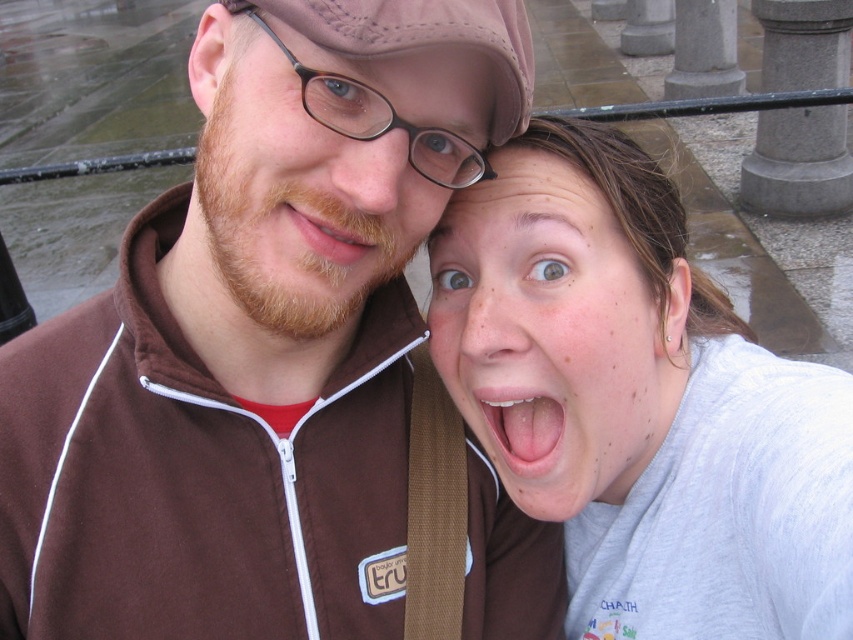
You are a fashion designer observing two jackets in an image. You need to determine which one is bigger. The jackets are the brown suede jacket at center and the matte brown jacket at upper left. Which one is larger?

The brown suede jacket at center is larger than the matte brown jacket at upper left.

You are taking a photo of two friends standing in front of you. The first friend is at point (105, 403) and the second is at point (531, 456). If you want to focus on the friend closer to you, which point should you aim the camera at?

You should aim the camera at point (105, 403) because it is closer to the camera than point (531, 456).